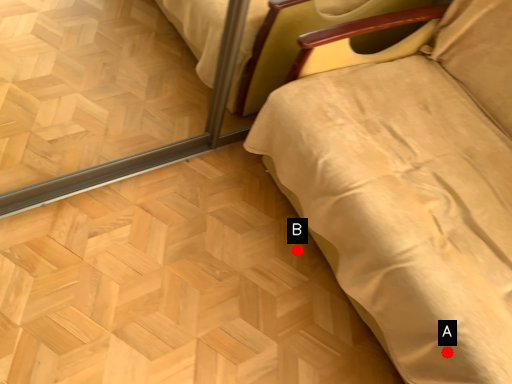
Question: Two points are circled on the image, labeled by A and B beside each circle. Which of the following is the farthest from the observer?

Choices:
 (A) A is further
 (B) B is further

Answer: (B)